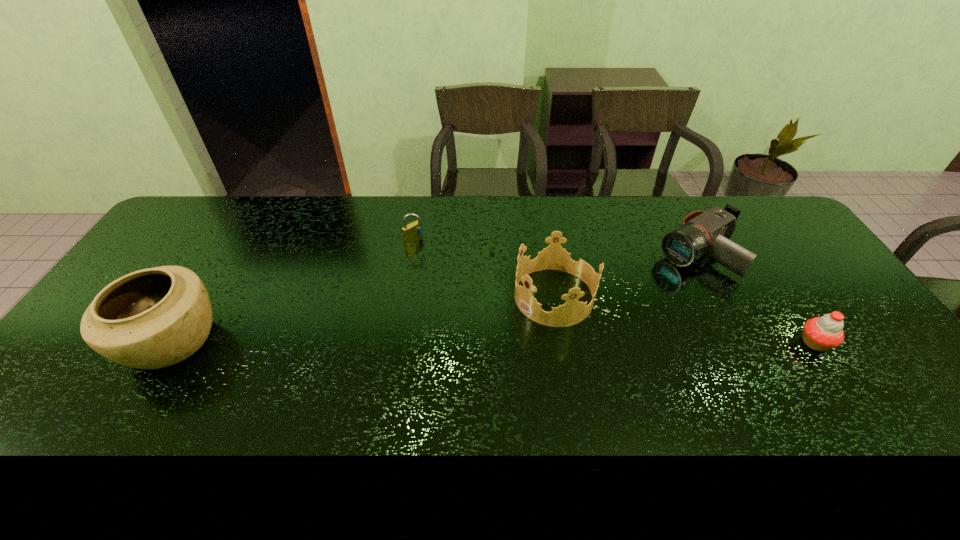
Find the location of a particular element. vacant space on the desktop that is between the leftmost object and the cupcake and is positioned on the front-facing side of the third object from left to right is located at coordinates (481, 342).

This screenshot has width=960, height=540. Find the location of `vacant spot on the desktop that is between the tallest object and the cupcake and is positioned on the lens of the camcorder`. vacant spot on the desktop that is between the tallest object and the cupcake and is positioned on the lens of the camcorder is located at coordinates click(557, 342).

Find the location of a particular element. free space on the desktop that is between the tallest object and the cupcake and is positioned on the side with the combination dials of the second object from left to right is located at coordinates pyautogui.click(x=542, y=342).